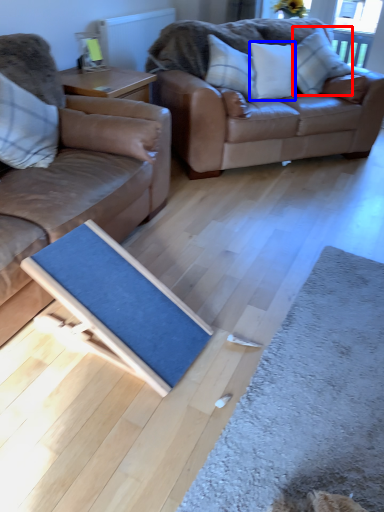
Question: Among these objects, which one is farthest to the camera, pillow (highlighted by a red box) or pillow (highlighted by a blue box)?

Choices:
 (A) pillow
 (B) pillow

Answer: (A)